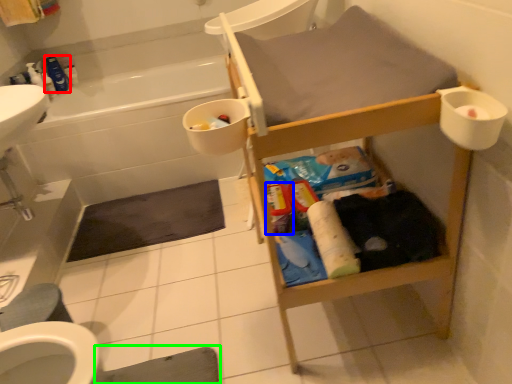
Question: Which is nearer to the cleaning product (highlighted by a red box)? toiletry (highlighted by a blue box) or bath mat (highlighted by a green box).

Choices:
 (A) toiletry
 (B) bath mat

Answer: (A)